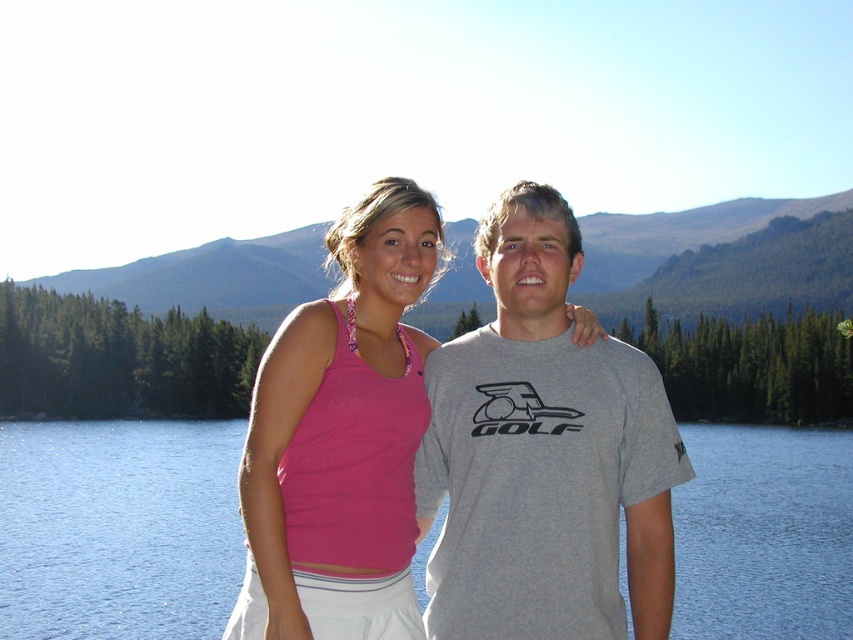
Question: Which of the following is the closest to the observer?

Choices:
 (A) gray cotton t-shirt at center
 (B) pink fabric tank top at center

Answer: (B)

Question: Is blue water at center to the left of pink fabric tank top at center from the viewer's perspective?

Choices:
 (A) no
 (B) yes

Answer: (B)

Question: Is pink fabric tank top at center in front of green forested mountain at upper center?

Choices:
 (A) yes
 (B) no

Answer: (A)

Question: Is gray cotton t-shirt at center to the left of pink fabric tank top at center from the viewer's perspective?

Choices:
 (A) no
 (B) yes

Answer: (A)

Question: Considering the real-world distances, which object is closest to the blue water at center?

Choices:
 (A) pink fabric tank top at center
 (B) gray cotton t-shirt at center

Answer: (B)

Question: Which object is the closest to the gray cotton t-shirt at center?

Choices:
 (A) green forested mountain at upper center
 (B) blue water at center
 (C) pink fabric tank top at center

Answer: (C)